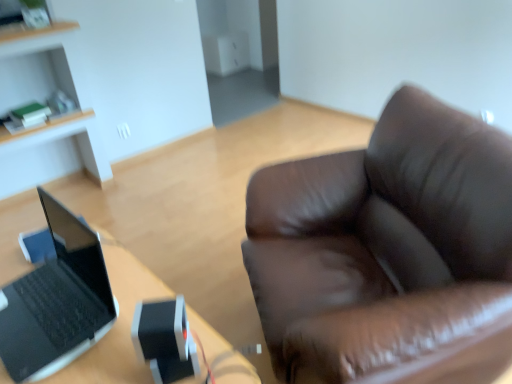
Question: Considering the positions of black matte laptop at left and light wood cabinet at upper left in the image, is black matte laptop at left wider or thinner than light wood cabinet at upper left?

Choices:
 (A) wide
 (B) thin

Answer: (B)

Question: Is point coord(39,274) positioned closer to the camera than point coord(53,34)?

Choices:
 (A) closer
 (B) farther

Answer: (A)

Question: Estimate the real-world distances between objects in this image. Which object is closer to the light wood cabinet at upper left?

Choices:
 (A) black matte laptop at left
 (B) black plastic laptop at left

Answer: (B)

Question: Based on their relative distances, which object is farther from the black plastic laptop at left?

Choices:
 (A) light wood cabinet at upper left
 (B) black matte laptop at left

Answer: (A)